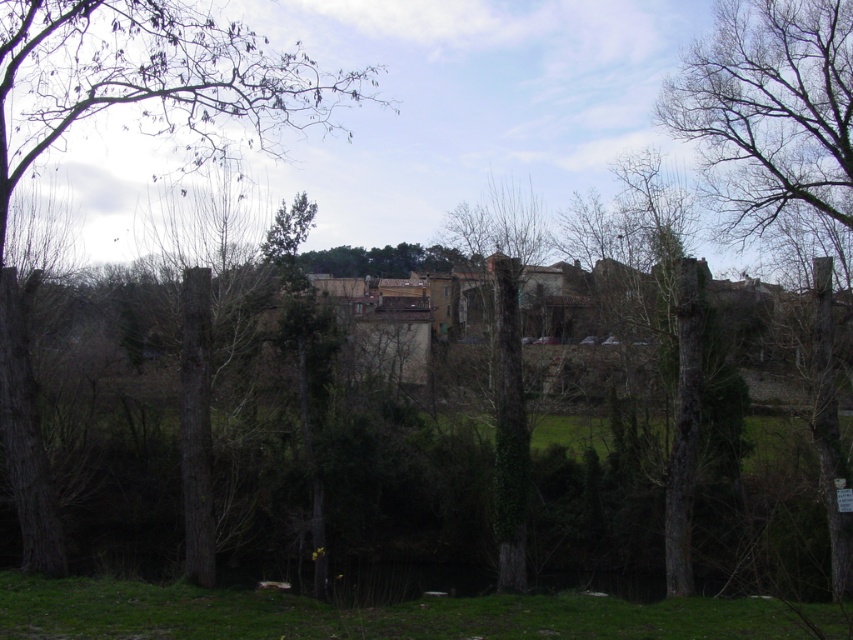
Question: Is brown wood tree at left to the left of green leafy tree at center from the viewer's perspective?

Choices:
 (A) no
 (B) yes

Answer: (B)

Question: Which object is the farthest from the smooth bark tree at right?

Choices:
 (A) brown wood tree at left
 (B) green leafy tree at center

Answer: (A)

Question: Can you confirm if brown wood tree at left is wider than green leafy tree at center?

Choices:
 (A) yes
 (B) no

Answer: (A)

Question: Does smooth bark tree at right have a larger size compared to green leafy tree at center?

Choices:
 (A) no
 (B) yes

Answer: (B)

Question: Which object is the closest to the brown wood tree at left?

Choices:
 (A) smooth bark tree at right
 (B) green leafy tree at center

Answer: (B)

Question: Which point appears farthest from the camera in this image?

Choices:
 (A) (86, 8)
 (B) (508, 440)
 (C) (759, 65)

Answer: (C)